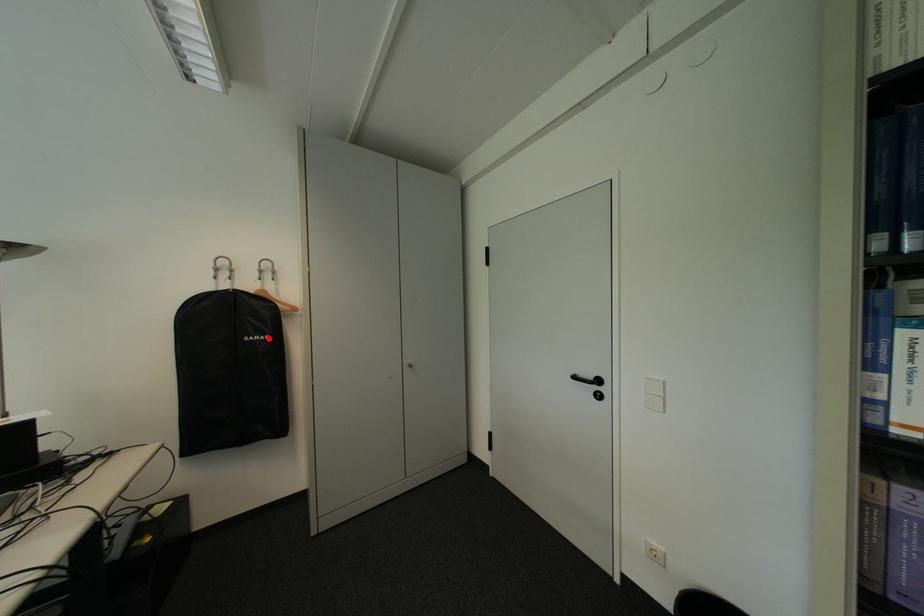
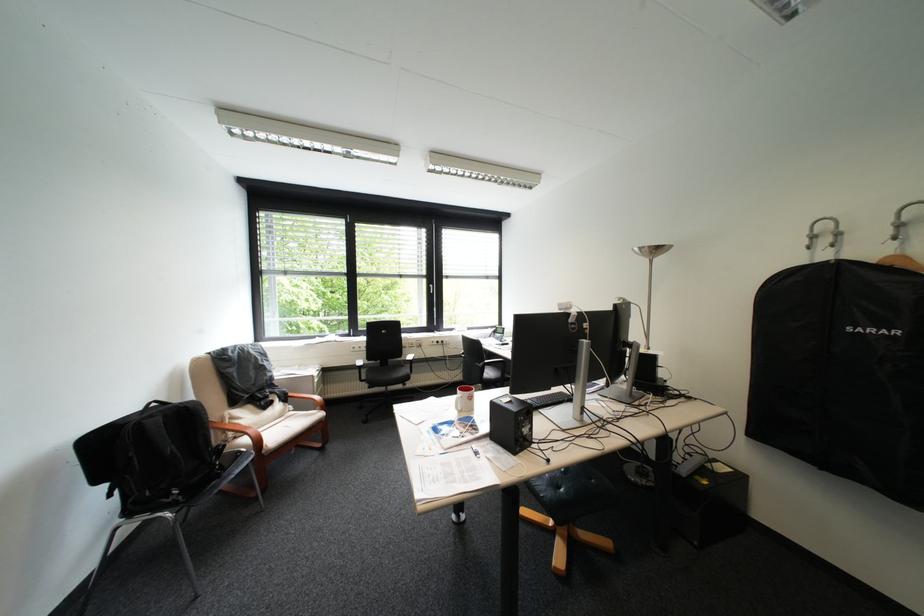
Where in the second image is the point corresponding to the highlighted location from the first image?

(883, 331)